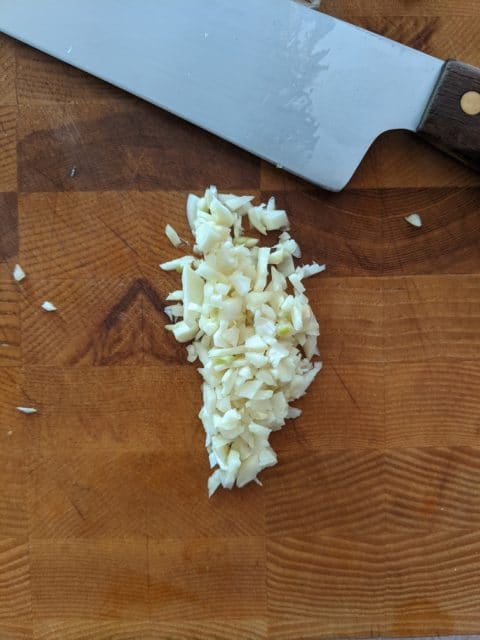
At what (x,y) coordinates should I click in order to perform the action: click on golden brown wood. Please return your answer as a coordinate pair (x, y). The width and height of the screenshot is (480, 640). Looking at the image, I should click on (71, 605).